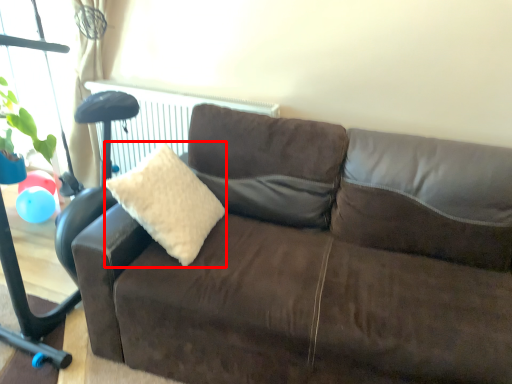
Question: From the image's perspective, what is the correct spatial positioning of throw pillow (annotated by the red box) in reference to studio couch?

Choices:
 (A) above
 (B) below

Answer: (A)